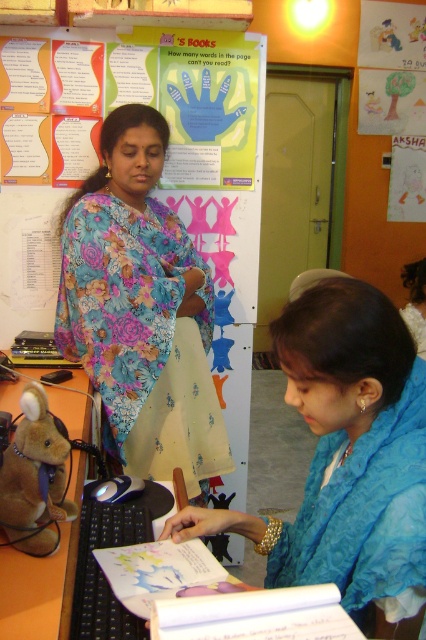
What is located at the coordinates point (345, 454)?

The blue fabric scarf at lower right is located at point (345, 454).

You are a student trying to reach the brown plush toy at lower left from your current position near the floral fabric saree at center. Which direction should you move to get to it?

The floral fabric saree at center is positioned on the right side of the brown plush toy at lower left, so you should move to the left to reach the brown plush toy at lower left.